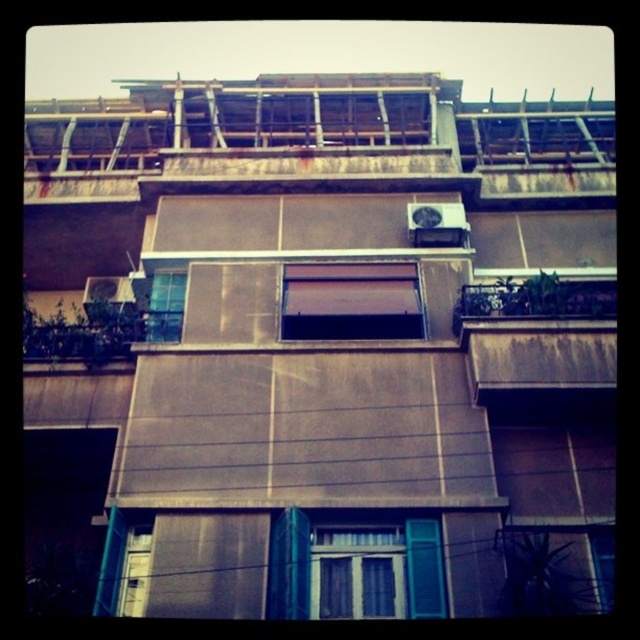
You are a painter who needs to cover all surfaces of the brown matte awning at center and the brown wooden balcony at right. If the balcony requires 2 liters of paint, how much paint do you need in total?

The brown matte awning at center is bigger than brown wooden balcony at right. Since the balcony requires 2 liters of paint, the awning would need more than 2 liters. Therefore, the total paint required would be more than 4 liters.